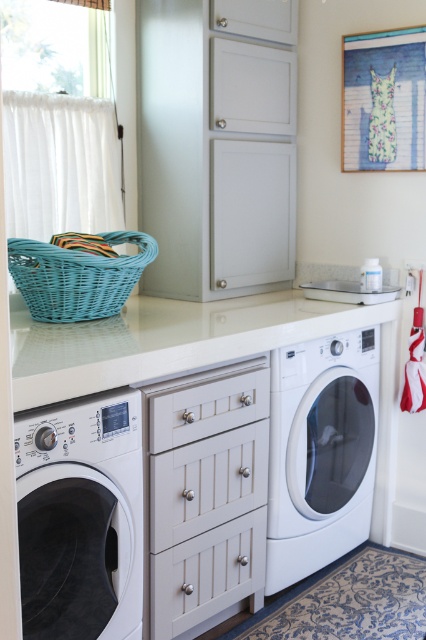
Looking at this image, you are organizing laundry items in the laundry room. You have a pair of socks that need to be washed. Which object should you place them in first, the white glossy washing machine at lower left or the teal wicker basket at upper left?

You should place the socks in the white glossy washing machine at lower left first because it is positioned to the right of the teal wicker basket at upper left, indicating it is the proper appliance for washing laundry.

Based on the photo, you are moving a laundry basket from the light blue wicker basket to the white glossy washing machine at lower left and then to the white glossy washing machine at lower right. Which washing machine requires you to lift the laundry basket higher?

The white glossy washing machine at lower right requires lifting the laundry basket higher because it has a greater height compared to the white glossy washing machine at lower left.

You are moving a laundry basket from the teal wicker basket at upper left to the white glossy washing machine at lower right. Which direction should you move the basket?

The white glossy washing machine at lower right is positioned on the right side of the teal wicker basket at upper left, so you should move the basket to the right.